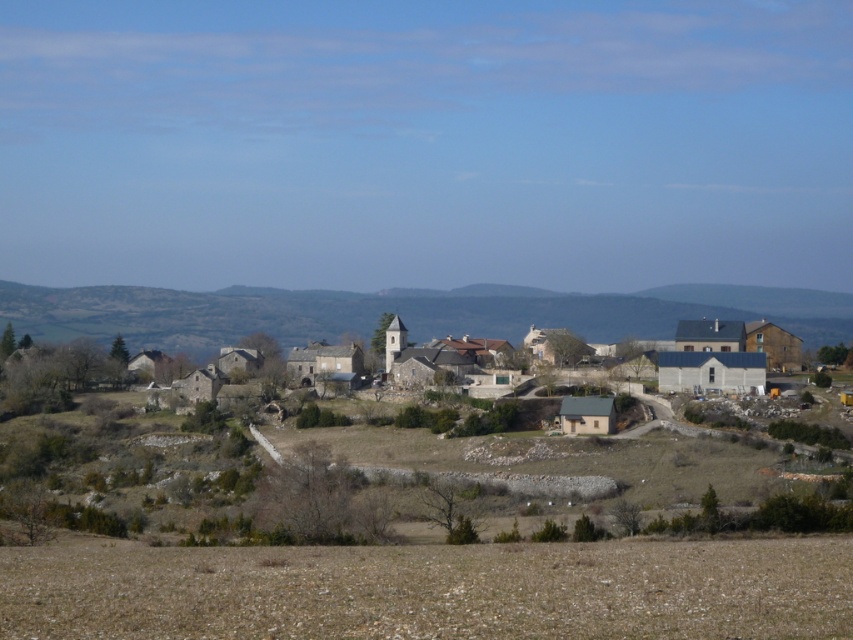
Can you confirm if brown grassland at lower center is shorter than stone houses at center?

Yes.

Which of these two, brown grassland at lower center or stone houses at center, stands taller?

stone houses at center

Does point (440, 627) come behind point (468, 356)?

No, (440, 627) is in front of (468, 356).

Find the location of a particular element. brown grassland at lower center is located at coordinates (431, 589).